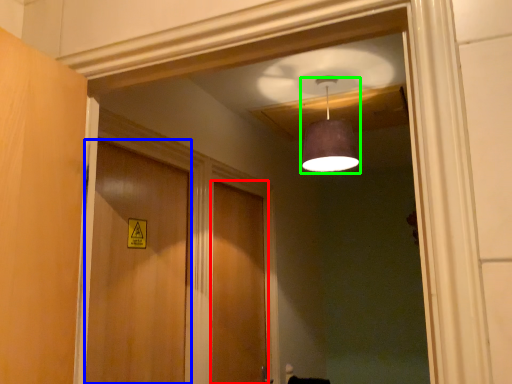
Question: Which is farther away from door (highlighted by a red box)? door (highlighted by a blue box) or light fixture (highlighted by a green box)?

Choices:
 (A) door
 (B) light fixture

Answer: (B)